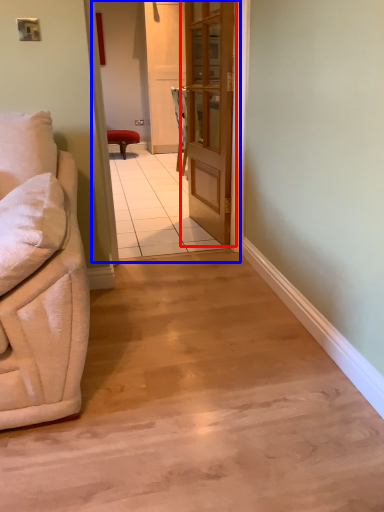
Question: Which object appears closest to the camera in this image, door (highlighted by a red box) or corridor (highlighted by a blue box)?

Choices:
 (A) door
 (B) corridor

Answer: (B)